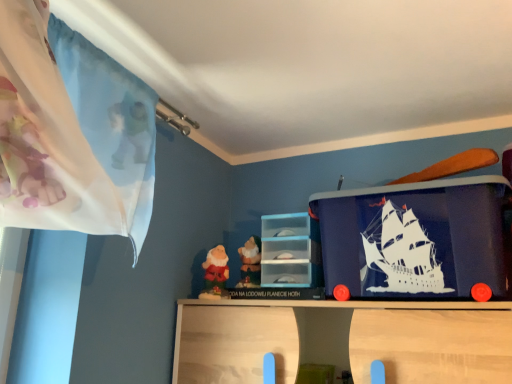
Where is `transparent plastic drawer at center`? The image size is (512, 384). transparent plastic drawer at center is located at coordinates click(x=291, y=251).

From a real-world perspective, is velvet red dwarf at center, which is counted as the 1th toy, starting from the left, positioned above or below matte plastic dwarf at center, marked as the second toy in a left-to-right arrangement?

velvet red dwarf at center, which is counted as the 1th toy, starting from the left, is below matte plastic dwarf at center, marked as the second toy in a left-to-right arrangement.

Is velvet red dwarf at center, which is counted as the 1th toy, starting from the left, spatially inside matte plastic dwarf at center, the 1th toy from the right, or outside of it?

velvet red dwarf at center, which is counted as the 1th toy, starting from the left, exists outside the volume of matte plastic dwarf at center, the 1th toy from the right.

Is point (200, 297) more distant than point (243, 261)?

No, it is in front of (243, 261).

What's the angular difference between velvet red dwarf at center, placed as the second toy when sorted from right to left, and matte plastic dwarf at center, the 1th toy from the right,'s facing directions?

There is a 26.7-degree angle between the facing directions of velvet red dwarf at center, placed as the second toy when sorted from right to left, and matte plastic dwarf at center, the 1th toy from the right.

Is velvet red dwarf at center, placed as the second toy when sorted from right to left, oriented away from transparent plastic drawer at center?

velvet red dwarf at center, placed as the second toy when sorted from right to left, is not turned away from transparent plastic drawer at center.

In the image, is velvet red dwarf at center, which is counted as the 1th toy, starting from the left, on the left side or the right side of transparent plastic drawer at center?

velvet red dwarf at center, which is counted as the 1th toy, starting from the left, is to the left of transparent plastic drawer at center.

Is the surface of velvet red dwarf at center, placed as the second toy when sorted from right to left, in direct contact with transparent plastic drawer at center?

No, velvet red dwarf at center, placed as the second toy when sorted from right to left, is not in contact with transparent plastic drawer at center.

From the image's perspective, which is below, velvet red dwarf at center, which is counted as the 1th toy, starting from the left, or transparent plastic drawer at center?

velvet red dwarf at center, which is counted as the 1th toy, starting from the left, appears lower in the image.

Is point (277, 228) closer to viewer compared to point (213, 272)?

That is False.

Is transparent plastic drawer at center beside velvet red dwarf at center, which is counted as the 1th toy, starting from the left?

transparent plastic drawer at center and velvet red dwarf at center, which is counted as the 1th toy, starting from the left, are clearly separated.

From the picture: Does transparent plastic drawer at center turn towards velvet red dwarf at center, which is counted as the 1th toy, starting from the left?

No.

Considering the positions of objects transparent plastic drawer at center and velvet red dwarf at center, which is counted as the 1th toy, starting from the left, in the image provided, who is more to the left, transparent plastic drawer at center or velvet red dwarf at center, which is counted as the 1th toy, starting from the left,?

From the viewer's perspective, velvet red dwarf at center, which is counted as the 1th toy, starting from the left, appears more on the left side.

Is matte plastic dwarf at center, the 1th toy from the right, turned away from velvet red dwarf at center, placed as the second toy when sorted from right to left?

No.

Is matte plastic dwarf at center, the 1th toy from the right, completely or partially outside of velvet red dwarf at center, which is counted as the 1th toy, starting from the left?

matte plastic dwarf at center, the 1th toy from the right, is positioned outside velvet red dwarf at center, which is counted as the 1th toy, starting from the left.

Based on their positions, is matte plastic dwarf at center, marked as the second toy in a left-to-right arrangement, located to the left or right of velvet red dwarf at center, placed as the second toy when sorted from right to left?

matte plastic dwarf at center, marked as the second toy in a left-to-right arrangement, is to the right of velvet red dwarf at center, placed as the second toy when sorted from right to left.

Which object is wider, matte plastic dwarf at center, the 1th toy from the right, or velvet red dwarf at center, placed as the second toy when sorted from right to left?

velvet red dwarf at center, placed as the second toy when sorted from right to left, is wider.

Can you confirm if matte plastic dwarf at center, marked as the second toy in a left-to-right arrangement, is smaller than transparent plastic drawer at center?

Yes, matte plastic dwarf at center, marked as the second toy in a left-to-right arrangement, is smaller than transparent plastic drawer at center.

Is matte plastic dwarf at center, the 1th toy from the right, facing away from transparent plastic drawer at center?

No, transparent plastic drawer at center is not at the back of matte plastic dwarf at center, the 1th toy from the right.

Between matte plastic dwarf at center, the 1th toy from the right, and transparent plastic drawer at center, which one has smaller width?

matte plastic dwarf at center, the 1th toy from the right, is thinner.

Image resolution: width=512 pixels, height=384 pixels. What are the coordinates of `the 2nd toy behind when counting from the transparent plastic drawer at center` in the screenshot? It's located at (250, 263).

From their relative heights in the image, would you say transparent plastic drawer at center is taller or shorter than matte plastic dwarf at center, the 1th toy from the right?

transparent plastic drawer at center is taller than matte plastic dwarf at center, the 1th toy from the right.

I want to click on shelf located on the right of matte plastic dwarf at center, marked as the second toy in a left-to-right arrangement, so click(x=291, y=251).

From the image's perspective, is transparent plastic drawer at center beneath matte plastic dwarf at center, marked as the second toy in a left-to-right arrangement?

No, from the image's perspective, transparent plastic drawer at center is not beneath matte plastic dwarf at center, marked as the second toy in a left-to-right arrangement.

Visually, is transparent plastic drawer at center positioned to the left or to the right of matte plastic dwarf at center, the 1th toy from the right?

From the image, it's evident that transparent plastic drawer at center is to the right of matte plastic dwarf at center, the 1th toy from the right.

Identify the location of toy in front of the matte plastic dwarf at center, marked as the second toy in a left-to-right arrangement. (215, 274).

Locate an element on the screen. The width and height of the screenshot is (512, 384). shelf located above the velvet red dwarf at center, which is counted as the 1th toy, starting from the left (from the image's perspective) is located at coordinates (291, 251).

Which object lies nearer to the anchor point velvet red dwarf at center, placed as the second toy when sorted from right to left, matte plastic dwarf at center, marked as the second toy in a left-to-right arrangement, or transparent plastic drawer at center?

matte plastic dwarf at center, marked as the second toy in a left-to-right arrangement, lies closer to velvet red dwarf at center, placed as the second toy when sorted from right to left, than the other object.

Looking at the image, which one is located further to transparent plastic drawer at center, matte plastic dwarf at center, marked as the second toy in a left-to-right arrangement, or velvet red dwarf at center, placed as the second toy when sorted from right to left?

velvet red dwarf at center, placed as the second toy when sorted from right to left.

From the image, which object appears to be farther from matte plastic dwarf at center, marked as the second toy in a left-to-right arrangement, transparent plastic drawer at center or velvet red dwarf at center, placed as the second toy when sorted from right to left?

Among the two, transparent plastic drawer at center is located further to matte plastic dwarf at center, marked as the second toy in a left-to-right arrangement.

Estimate the real-world distances between objects in this image. Which object is closer to velvet red dwarf at center, placed as the second toy when sorted from right to left, transparent plastic drawer at center or matte plastic dwarf at center, the 1th toy from the right?

matte plastic dwarf at center, the 1th toy from the right, is closer to velvet red dwarf at center, placed as the second toy when sorted from right to left.

From the image, which object appears to be nearer to matte plastic dwarf at center, the 1th toy from the right, velvet red dwarf at center, which is counted as the 1th toy, starting from the left, or transparent plastic drawer at center?

velvet red dwarf at center, which is counted as the 1th toy, starting from the left, is positioned closer to the anchor matte plastic dwarf at center, the 1th toy from the right.

Looking at the image, which one is located further to transparent plastic drawer at center, velvet red dwarf at center, placed as the second toy when sorted from right to left, or matte plastic dwarf at center, the 1th toy from the right?

velvet red dwarf at center, placed as the second toy when sorted from right to left, is positioned further to the anchor transparent plastic drawer at center.

The height and width of the screenshot is (384, 512). Identify the location of toy between velvet red dwarf at center, placed as the second toy when sorted from right to left, and transparent plastic drawer at center from left to right. (250, 263).